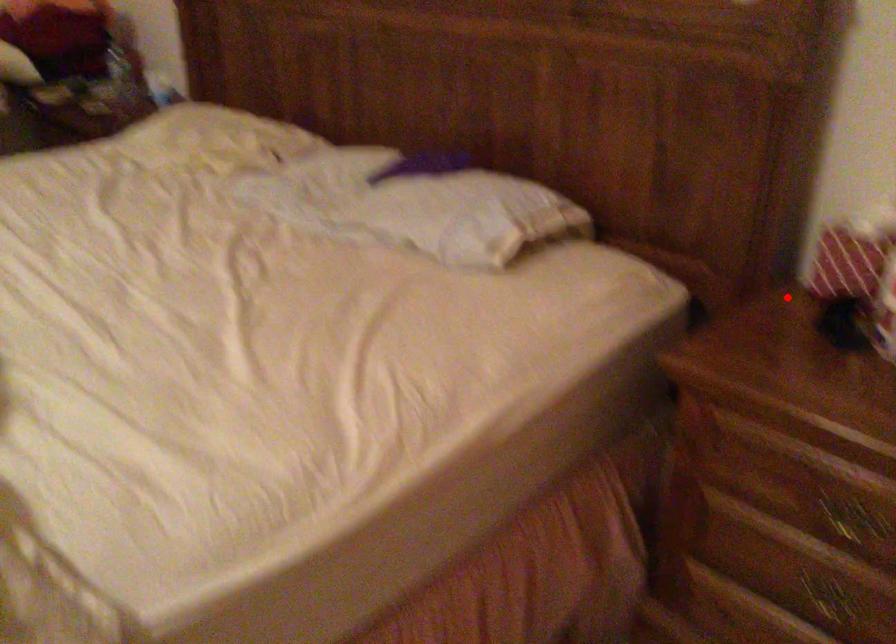
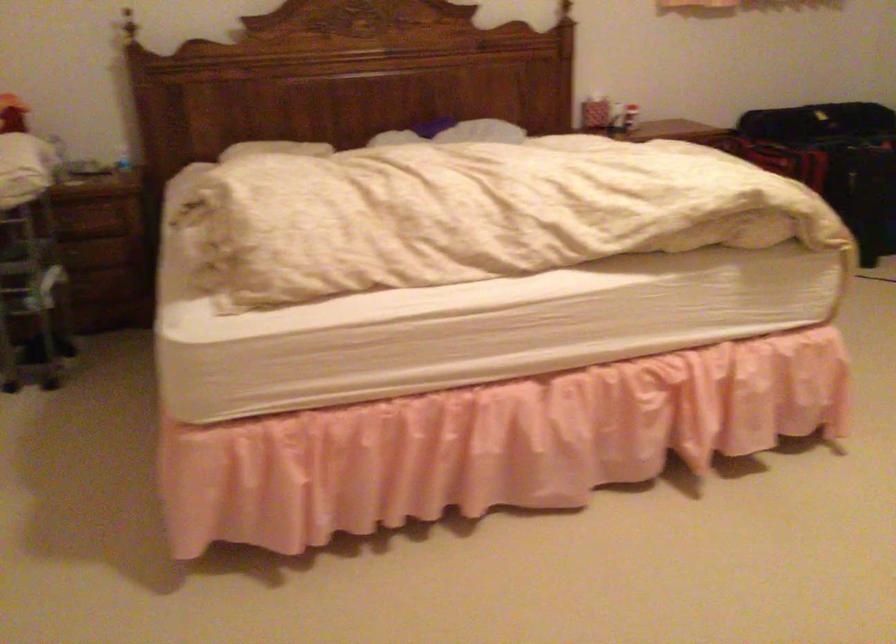
The point at the highlighted location is marked in the first image. Where is the corresponding point in the second image?

(590, 109)